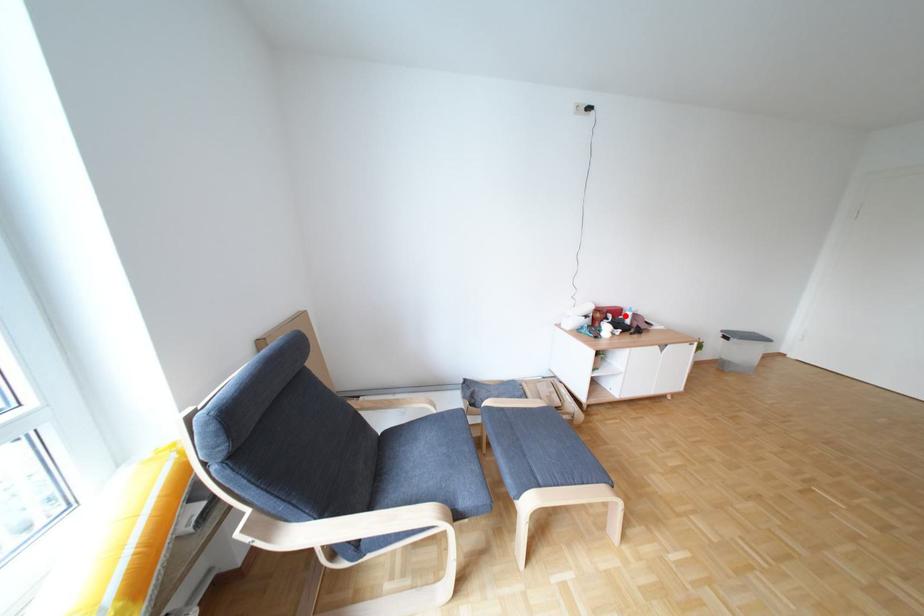
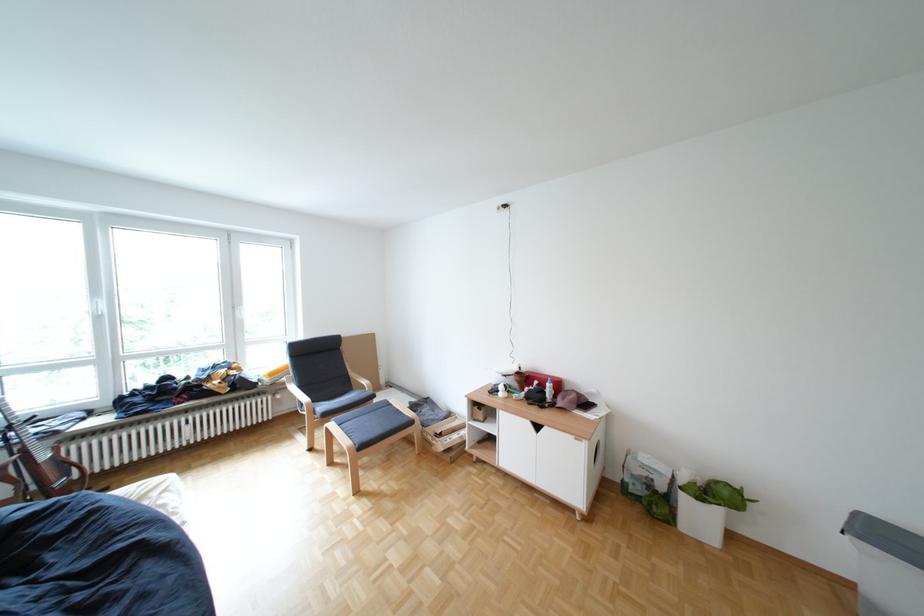
Locate, in the second image, the point that corresponds to the highlighted location in the first image.

(552, 383)